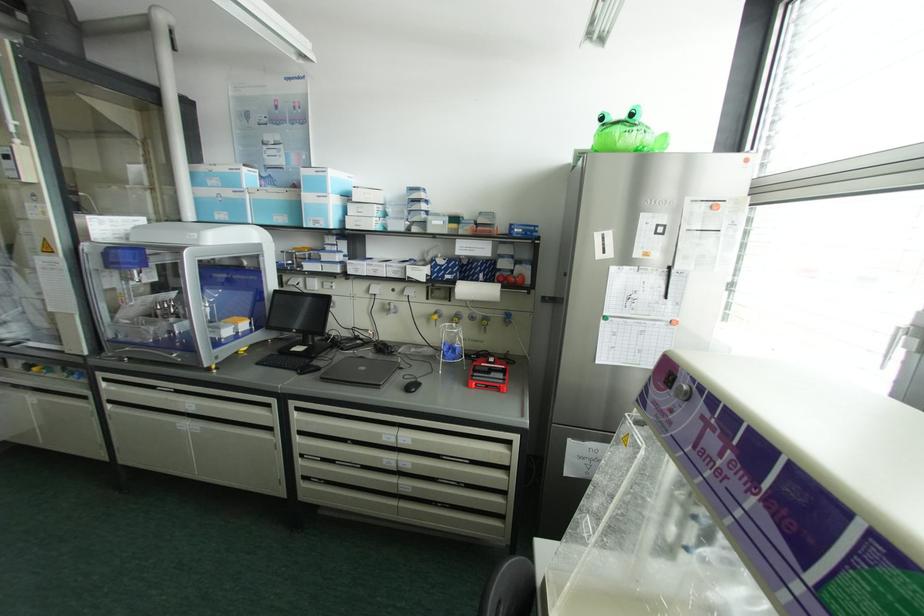
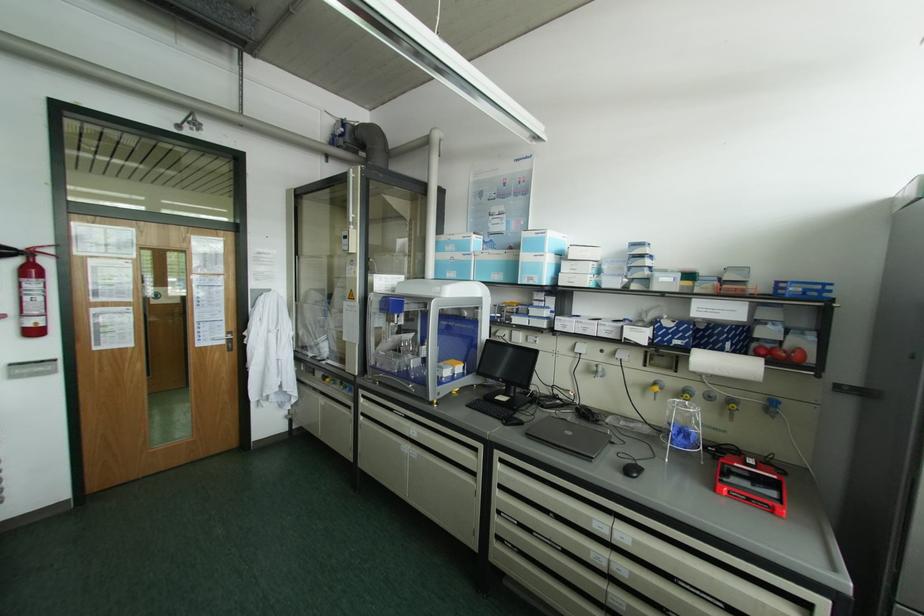
In the second image, find the point that corresponds to (225,331) in the first image.

(445, 371)